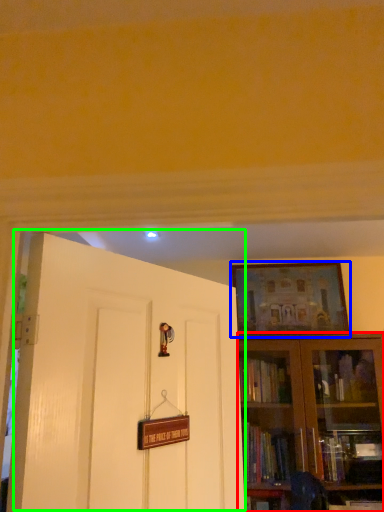
Question: Based on their relative distances, which object is farther from bookcase (highlighted by a red box)? Choose from picture frame (highlighted by a blue box) and door (highlighted by a green box).

Choices:
 (A) picture frame
 (B) door

Answer: (B)